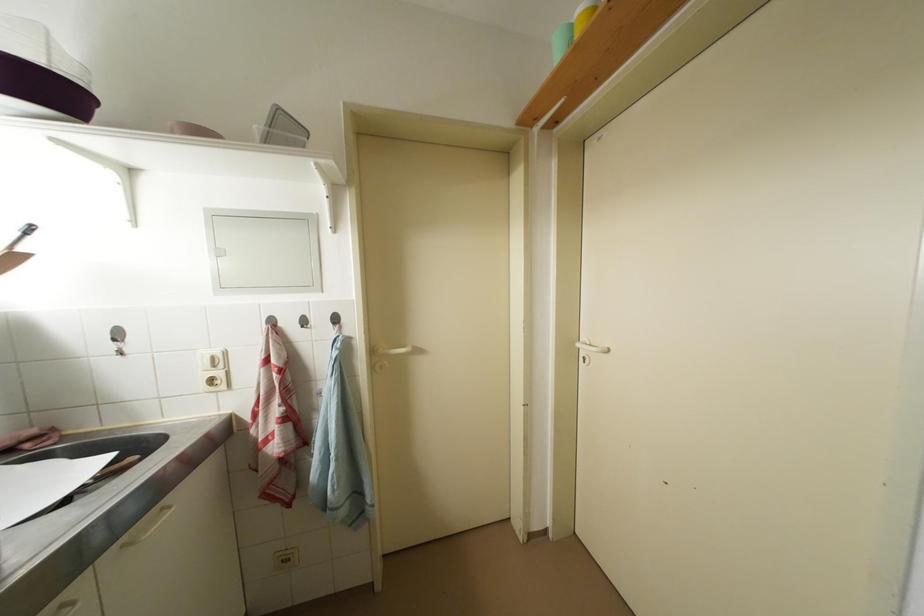
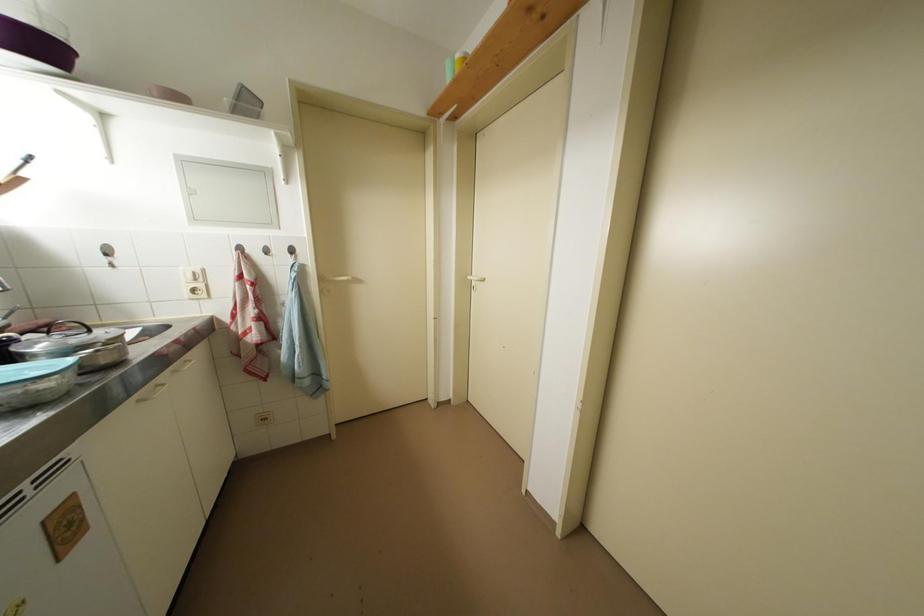
Locate, in the second image, the point that corresponds to point (585, 349) in the first image.

(476, 282)